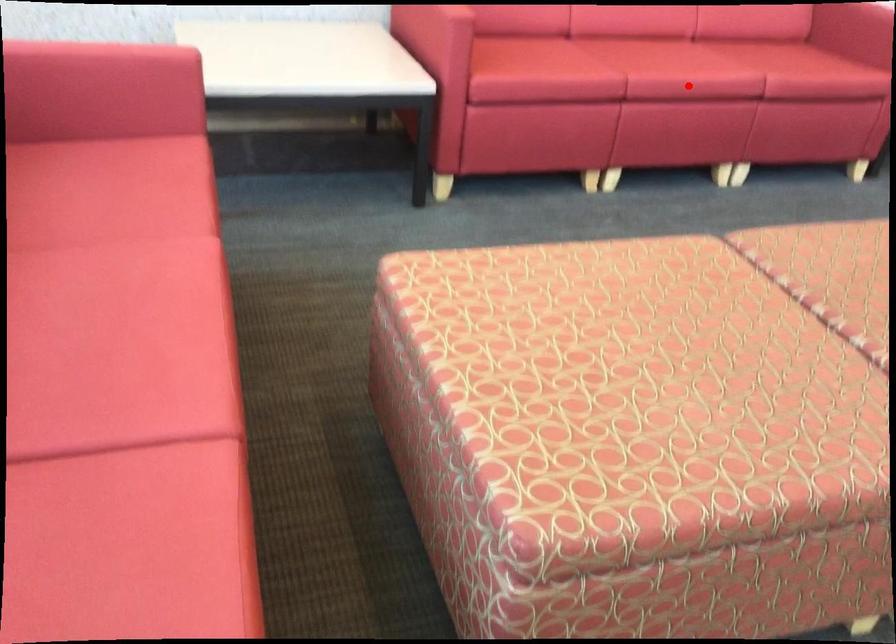
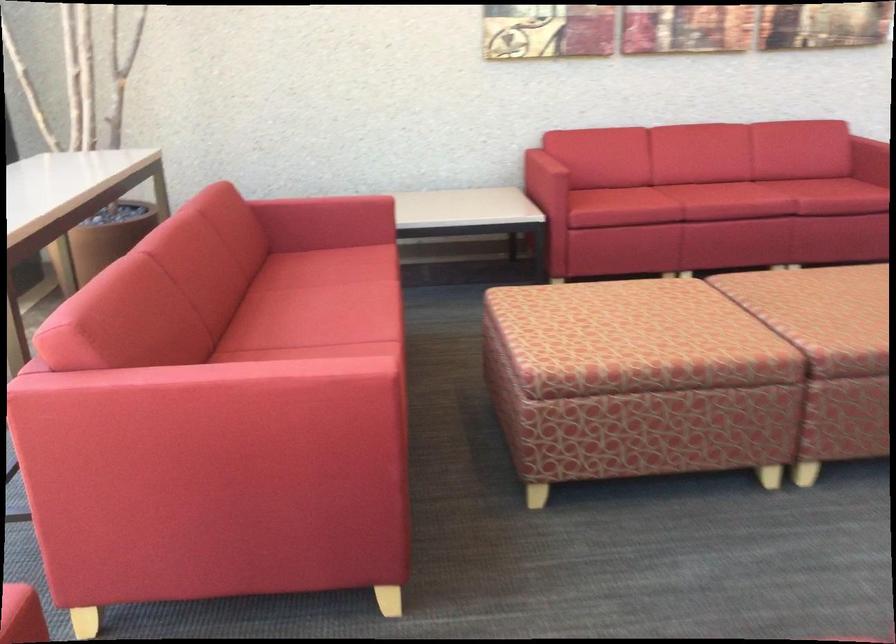
Question: I am providing you with two images of the same scene from different viewpoints. Given a red point in image1, look at the same physical point in image2. Is it:

Choices:
 (A) Closer to the viewpoint
 (B) Farther from the viewpoint

Answer: (B)